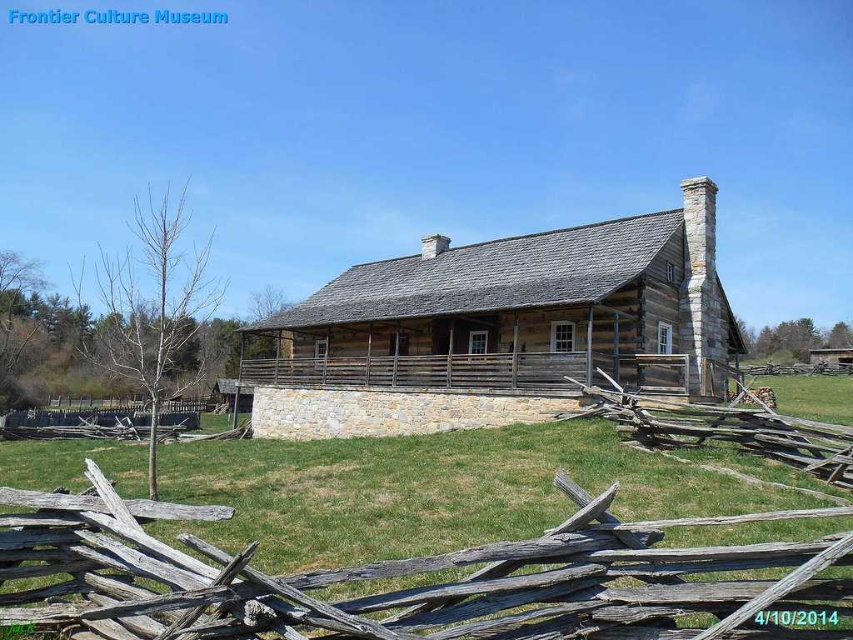
You are standing in front of the rustic wood cabin at center and want to walk to the weathered wood fence at lower center. Which direction should you move to reach the fence?

The weathered wood fence at lower center is closer to the viewer than the rustic wood cabin at center, so you should move forward towards the fence since it is in front of the cabin.

You are a visitor at the Frontier Culture Museum and want to take a photo of the rustic wood cabin at center from behind the weathered wood fence at lower center. The camera you are using has a maximum focus range of 20 meters. Will you be able to capture the cabin clearly from your current position behind the fence?

The distance between the weathered wood fence at lower center and rustic wood cabin at center is 17.52 meters, which is within the camera maximum focus range of 20 meters. Therefore, you can capture the cabin clearly from your current position behind the fence.